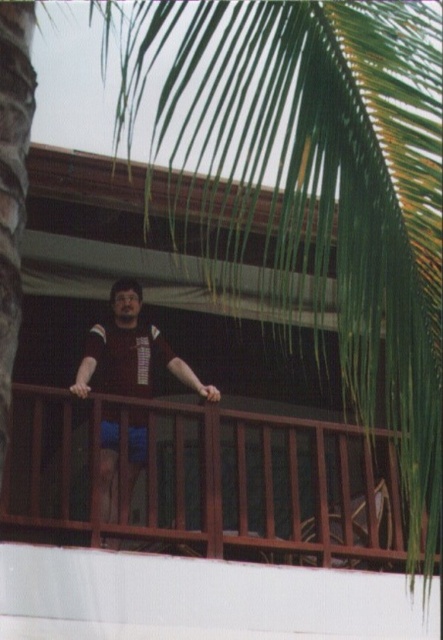
You are a drone operator trying to deliver a package to a balcony. The delivery zone is marked at point 0.748, 0.470. You see the brown wooden railing at center. Is the delivery zone on the railing?

The brown wooden railing at center is located at point [208,477], so the delivery zone is on the railing.

You are a photographer trying to capture the person on the balcony. You want to ensure the matte black shirt at center and the brown wooden railing at center are both in focus. Which object should you position your camera closer to to achieve this?

Since the brown wooden railing at center is to the right of the matte black shirt at center, you should position your camera closer to the matte black shirt at center to ensure both are in focus, as they are aligned along the same plane.

You are a photographer trying to capture the person on the balcony. You notice the brown wooden railing at center and the matte black shirt at center. Which object should you focus on first if you want to ensure both are in the frame without moving the camera?

The brown wooden railing at center is smaller than the matte black shirt at center, so you should focus on the matte black shirt at center first since it is larger and will be easier to frame properly.